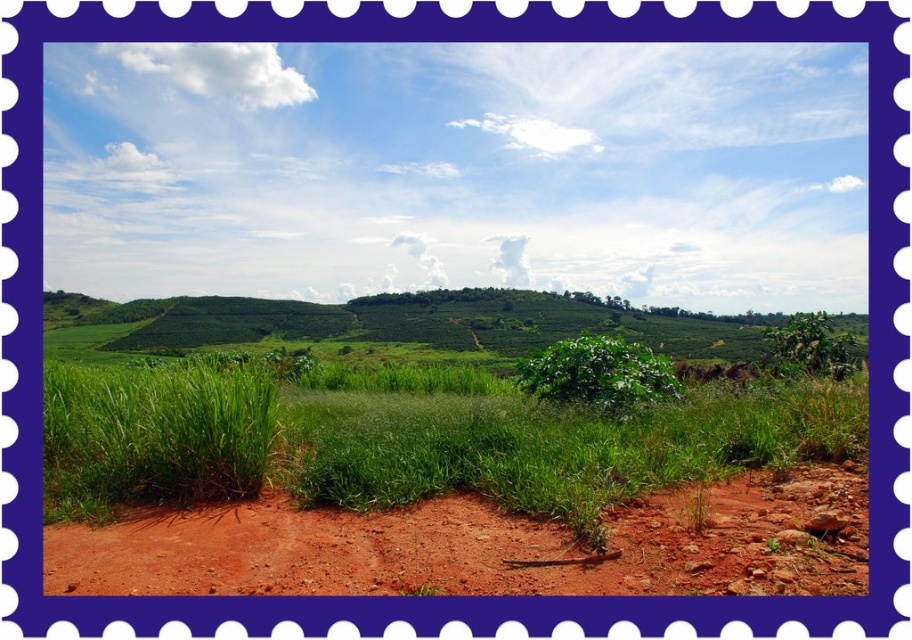
In the scene shown: Can you confirm if green leafy grass at center is positioned to the right of reddish-brown soil at lower center?

In fact, green leafy grass at center is to the left of reddish-brown soil at lower center.

Measure the distance between green leafy grass at center and camera.

26.84 feet

Locate an element on the screen. Image resolution: width=912 pixels, height=640 pixels. green leafy grass at center is located at coordinates (417, 442).

What do you see at coordinates (417, 442) in the screenshot? This screenshot has width=912, height=640. I see `green leafy grass at center` at bounding box center [417, 442].

Can you confirm if green leafy grass at center is wider than green leafy bush at center?

Yes.

Who is more forward, (407, 413) or (618, 406)?

Positioned in front is point (407, 413).

At what (x,y) coordinates should I click in order to perform the action: click on green leafy grass at center. Please return your answer as a coordinate pair (x, y). The width and height of the screenshot is (912, 640). Looking at the image, I should click on (417, 442).

Can you confirm if green grassy hillside at center is smaller than green leafy bush at center?

No, green grassy hillside at center is not smaller than green leafy bush at center.

Which is in front, point (322, 317) or point (575, 392)?

Point (575, 392) is more forward.

Image resolution: width=912 pixels, height=640 pixels. Find the location of `green grassy hillside at center`. green grassy hillside at center is located at coordinates (403, 323).